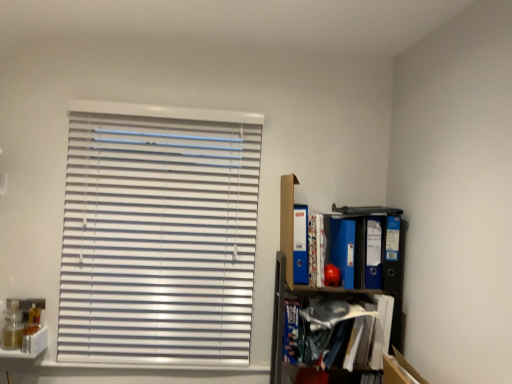
Where is `patterned paper book at upper right, which is the first book in top-to-bottom order`? This screenshot has width=512, height=384. patterned paper book at upper right, which is the first book in top-to-bottom order is located at coordinates (316, 250).

Find the location of a particular element. Image resolution: width=512 pixels, height=384 pixels. blue glossy folder at right, the 1th paperback book from the right is located at coordinates (393, 256).

How much space does blue matte folder at right, positioned as the 2th paperback book in right-to-left order, occupy horizontally?

It is 24.01 centimeters.

Image resolution: width=512 pixels, height=384 pixels. Describe the element at coordinates (300, 245) in the screenshot. I see `blue matte folder at upper right, the 1th paperback book when ordered from left to right` at that location.

Where is `patterned paper book at upper right, the 2th book viewed from the left`? patterned paper book at upper right, the 2th book viewed from the left is located at coordinates 316,250.

Between blue glossy folder at right, the 4th paperback book from the left, and blue matte folder at upper right, the 1th paperback book when ordered from left to right, which one appears on the left side from the viewer's perspective?

Positioned to the left is blue matte folder at upper right, the 1th paperback book when ordered from left to right.

Is point (385, 277) farther from camera compared to point (298, 211)?

That is False.

Could you tell me if blue glossy folder at right, the 4th paperback book from the left, is facing blue matte folder at upper right, the 1th paperback book when ordered from left to right?

No, blue glossy folder at right, the 4th paperback book from the left, is not turned towards blue matte folder at upper right, the 1th paperback book when ordered from left to right.

Does blue glossy folder at right, the 4th paperback book from the left, touch blue matte folder at upper right, the 1th paperback book when ordered from left to right?

No.

Can you confirm if blue matte folder at right, positioned as the 2th paperback book in right-to-left order, is shorter than matte blue paperback book at right, the 3th paperback book viewed from the right?

Correct, blue matte folder at right, positioned as the 2th paperback book in right-to-left order, is not as tall as matte blue paperback book at right, the 3th paperback book viewed from the right.

From a real-world perspective, who is located lower, blue matte folder at right, placed as the 3th paperback book when sorted from left to right, or matte blue paperback book at right, the 3th paperback book viewed from the right?

In real-world perspective, matte blue paperback book at right, the 3th paperback book viewed from the right, is lower.

Looking at their sizes, would you say blue matte folder at right, placed as the 3th paperback book when sorted from left to right, is wider or thinner than matte blue paperback book at right, the 3th paperback book viewed from the right?

Clearly, blue matte folder at right, placed as the 3th paperback book when sorted from left to right, has less width compared to matte blue paperback book at right, the 3th paperback book viewed from the right.

From a real-world perspective, is blue matte folder at right, placed as the 3th paperback book when sorted from left to right, positioned above or below patterned paper book at upper right, the second book when ordered from bottom to top?

From a real-world perspective, blue matte folder at right, placed as the 3th paperback book when sorted from left to right, is physically above patterned paper book at upper right, the second book when ordered from bottom to top.

Can you confirm if blue matte folder at right, positioned as the 2th paperback book in right-to-left order, is positioned to the right of patterned paper book at upper right, which is the first book in top-to-bottom order?

Yes.

Is blue matte folder at right, positioned as the 2th paperback book in right-to-left order, further to the viewer compared to patterned paper book at upper right, the second book when ordered from bottom to top?

Yes, it is.

Does blue matte folder at right, positioned as the 2th paperback book in right-to-left order, have a larger size compared to patterned paper book at upper right, the second book when ordered from bottom to top?

Yes, blue matte folder at right, positioned as the 2th paperback book in right-to-left order, is bigger than patterned paper book at upper right, the second book when ordered from bottom to top.

Is matte blue paperback book at right, which is the second paperback book in left-to-right order, positioned with its back to blue matte folder at upper right, which is the 4th paperback book in right-to-left order?

No, matte blue paperback book at right, which is the second paperback book in left-to-right order, is not facing away from blue matte folder at upper right, which is the 4th paperback book in right-to-left order.

From the picture: Measure the distance from matte blue paperback book at right, which is the second paperback book in left-to-right order, to blue matte folder at upper right, the 1th paperback book when ordered from left to right.

6.95 inches.

From the image's perspective, between matte blue paperback book at right, the 3th paperback book viewed from the right, and blue matte folder at upper right, the 1th paperback book when ordered from left to right, who is located below?

matte blue paperback book at right, the 3th paperback book viewed from the right.

How far apart are blue matte book at lower right, which is the first book in left-to-right order, and patterned paper book at upper right, which is the first book in top-to-bottom order?

blue matte book at lower right, which is the first book in left-to-right order, and patterned paper book at upper right, which is the first book in top-to-bottom order, are 10.03 inches apart from each other.

Is blue matte book at lower right, placed as the second book when sorted from right to left, next to patterned paper book at upper right, the 2th book viewed from the left?

No, blue matte book at lower right, placed as the second book when sorted from right to left, is not beside patterned paper book at upper right, the 2th book viewed from the left.

Based on the photo, from a real-world perspective, is blue matte book at lower right, which appears as the 1th book when ordered from the bottom, physically located above or below patterned paper book at upper right, the second book when ordered from bottom to top?

In terms of real-world spatial position, blue matte book at lower right, which appears as the 1th book when ordered from the bottom, is below patterned paper book at upper right, the second book when ordered from bottom to top.

Is point (290, 342) positioned before point (321, 234)?

Yes, it is in front of point (321, 234).

Is patterned paper book at upper right, the second book when ordered from bottom to top, completely or partially inside matte blue paperback book at right, the 3th paperback book viewed from the right?

Definitely not — patterned paper book at upper right, the second book when ordered from bottom to top, is not inside matte blue paperback book at right, the 3th paperback book viewed from the right.

Relative to patterned paper book at upper right, which is the first book in top-to-bottom order, is matte blue paperback book at right, the 3th paperback book viewed from the right, in front or behind?

Clearly, matte blue paperback book at right, the 3th paperback book viewed from the right, is behind patterned paper book at upper right, which is the first book in top-to-bottom order.

Would you say matte blue paperback book at right, the 3th paperback book viewed from the right, is to the left or to the right of patterned paper book at upper right, the 2th book viewed from the left, in the picture?

Clearly, matte blue paperback book at right, the 3th paperback book viewed from the right, is on the right of patterned paper book at upper right, the 2th book viewed from the left, in the image.

From a real-world perspective, is matte blue paperback book at right, which is the second paperback book in left-to-right order, above or below blue glossy folder at right, the 4th paperback book from the left?

matte blue paperback book at right, which is the second paperback book in left-to-right order, is situated lower than blue glossy folder at right, the 4th paperback book from the left, in the real world.

Which object is positioned more to the left, matte blue paperback book at right, which is the second paperback book in left-to-right order, or blue glossy folder at right, the 1th paperback book from the right?

matte blue paperback book at right, which is the second paperback book in left-to-right order.

Between matte blue paperback book at right, the 3th paperback book viewed from the right, and blue glossy folder at right, the 1th paperback book from the right, which one has smaller size?

matte blue paperback book at right, the 3th paperback book viewed from the right.

Can you tell me how much matte blue paperback book at right, which is the second paperback book in left-to-right order, and blue glossy folder at right, the 1th paperback book from the right, differ in facing direction?

The facing directions of matte blue paperback book at right, which is the second paperback book in left-to-right order, and blue glossy folder at right, the 1th paperback book from the right, are 5.18 degrees apart.

Where is `the 3rd paperback book counting from the left side of the blue glossy folder at right, the 1th paperback book from the right`? the 3rd paperback book counting from the left side of the blue glossy folder at right, the 1th paperback book from the right is located at coordinates (300, 245).

There is a blue matte folder at right, positioned as the 2th paperback book in right-to-left order. Identify the location of the 1st paperback book below it (from the image's perspective). The width and height of the screenshot is (512, 384). (343, 249).

Based on their spatial positions, is blue matte folder at upper right, the 1th paperback book when ordered from left to right, or blue glossy folder at right, the 1th paperback book from the right, further from blue matte book at lower right, which ranks as the 2th book in top-to-bottom order?

blue glossy folder at right, the 1th paperback book from the right, lies further to blue matte book at lower right, which ranks as the 2th book in top-to-bottom order, than the other object.

Estimate the real-world distances between objects in this image. Which object is further from blue matte book at lower right, which appears as the 1th book when ordered from the bottom, matte blue paperback book at right, which is the second paperback book in left-to-right order, or blue glossy folder at right, the 1th paperback book from the right?

blue glossy folder at right, the 1th paperback book from the right.

From the image, which object appears to be nearer to patterned paper book at upper right, which is the first book in top-to-bottom order, blue matte folder at right, placed as the 3th paperback book when sorted from left to right, or blue matte book at lower right, which appears as the 1th book when ordered from the bottom?

blue matte folder at right, placed as the 3th paperback book when sorted from left to right.

From the image, which object appears to be farther from patterned paper book at upper right, which is the first book in top-to-bottom order, blue matte book at lower right, which is the first book in left-to-right order, or matte blue paperback book at right, which is the second paperback book in left-to-right order?

Based on the image, blue matte book at lower right, which is the first book in left-to-right order, appears to be further to patterned paper book at upper right, which is the first book in top-to-bottom order.

From the image, which object appears to be farther from blue matte folder at upper right, which is the 4th paperback book in right-to-left order, blue matte book at lower right, placed as the second book when sorted from right to left, or matte blue paperback book at right, which is the second paperback book in left-to-right order?

blue matte book at lower right, placed as the second book when sorted from right to left, lies further to blue matte folder at upper right, which is the 4th paperback book in right-to-left order, than the other object.

When comparing their distances from matte blue paperback book at right, which is the second paperback book in left-to-right order, does blue matte folder at upper right, the 1th paperback book when ordered from left to right, or patterned paper book at upper right, which is the first book in top-to-bottom order, seem further?

blue matte folder at upper right, the 1th paperback book when ordered from left to right, is positioned further to the anchor matte blue paperback book at right, which is the second paperback book in left-to-right order.

Which object lies further to the anchor point matte blue paperback book at right, the 3th paperback book viewed from the right, blue glossy folder at right, the 1th paperback book from the right, or blue matte folder at right, positioned as the 2th paperback book in right-to-left order?

Among the two, blue glossy folder at right, the 1th paperback book from the right, is located further to matte blue paperback book at right, the 3th paperback book viewed from the right.

Considering their positions, is blue matte book at lower right, which appears as the 1th book when ordered from the bottom, positioned closer to patterned paper book at upper right, the 2th book viewed from the left, than blue glossy folder at right, the 4th paperback book from the left?

blue matte book at lower right, which appears as the 1th book when ordered from the bottom, is closer to patterned paper book at upper right, the 2th book viewed from the left.

Where is `book between blue matte folder at upper right, which is the 4th paperback book in right-to-left order, and blue matte folder at right, placed as the 3th paperback book when sorted from left to right, from left to right`? The image size is (512, 384). book between blue matte folder at upper right, which is the 4th paperback book in right-to-left order, and blue matte folder at right, placed as the 3th paperback book when sorted from left to right, from left to right is located at coordinates (316, 250).

Where is `book between blue matte folder at upper right, the 1th paperback book when ordered from left to right, and matte blue paperback book at right, the 3th paperback book viewed from the right, from left to right`? book between blue matte folder at upper right, the 1th paperback book when ordered from left to right, and matte blue paperback book at right, the 3th paperback book viewed from the right, from left to right is located at coordinates (316, 250).

Where is `paperback book situated between patterned paper book at upper right, which is the first book in top-to-bottom order, and blue matte folder at right, placed as the 3th paperback book when sorted from left to right, from left to right`? The width and height of the screenshot is (512, 384). paperback book situated between patterned paper book at upper right, which is the first book in top-to-bottom order, and blue matte folder at right, placed as the 3th paperback book when sorted from left to right, from left to right is located at coordinates (343, 249).

Find the location of a particular element. This screenshot has width=512, height=384. book between blue matte folder at upper right, the 1th paperback book when ordered from left to right, and blue matte book at lower right, which is the first book in left-to-right order, in the up-down direction is located at coordinates (316, 250).